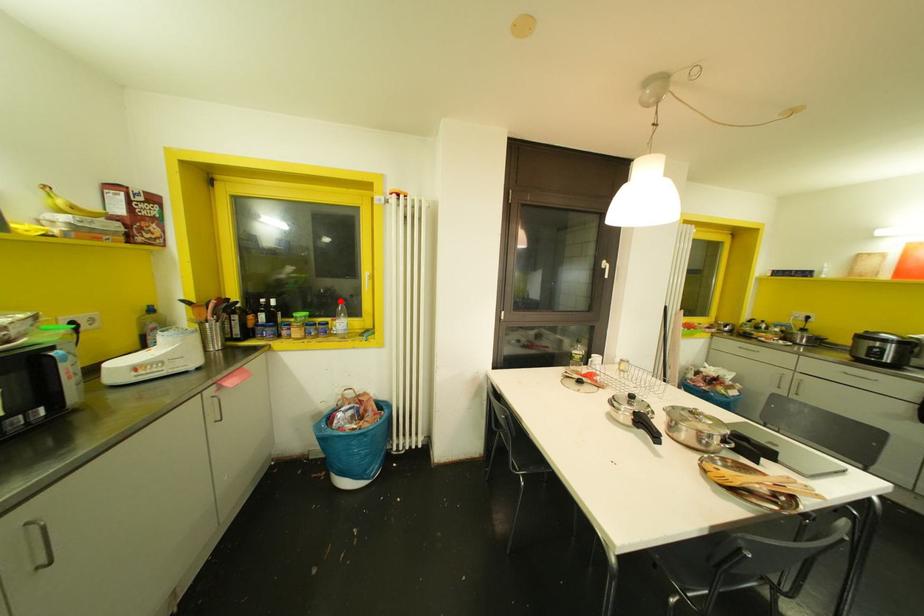
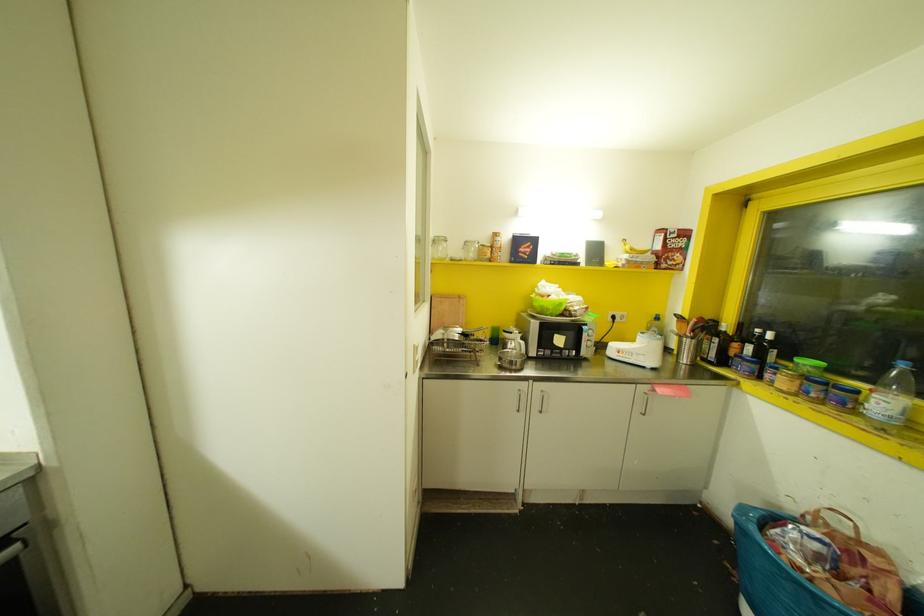
Where in the second image is the point corresponding to the highlighted location from the first image?

(902, 363)